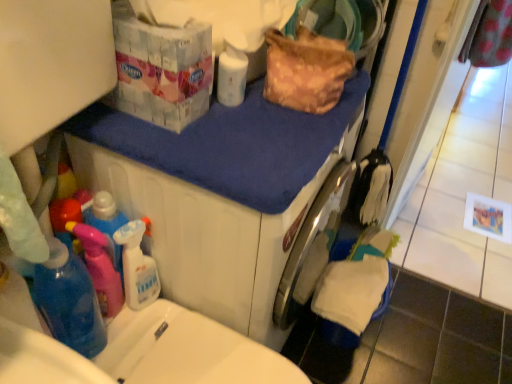
Question: Should I look upward or downward to see white glossy bottle at upper center?

Choices:
 (A) up
 (B) down

Answer: (A)

Question: Are white glossy bottle at upper center and blue fabric at upper center located far from each other?

Choices:
 (A) yes
 (B) no

Answer: (B)

Question: Is white glossy bottle at upper center not within blue fabric at upper center?

Choices:
 (A) no
 (B) yes

Answer: (B)

Question: From the image's perspective, is white glossy bottle at upper center over blue fabric at upper center?

Choices:
 (A) no
 (B) yes

Answer: (B)

Question: From a real-world perspective, is white glossy bottle at upper center on top of blue fabric at upper center?

Choices:
 (A) no
 (B) yes

Answer: (B)

Question: From the image's perspective, does white glossy bottle at upper center appear lower than blue fabric at upper center?

Choices:
 (A) yes
 (B) no

Answer: (B)

Question: From a real-world perspective, does white glossy bottle at upper center sit lower than blue fabric at upper center?

Choices:
 (A) no
 (B) yes

Answer: (A)

Question: Considering the relative positions of blue fabric at upper center and white glossy bottle at upper center in the image provided, is blue fabric at upper center to the right of white glossy bottle at upper center from the viewer's perspective?

Choices:
 (A) yes
 (B) no

Answer: (A)

Question: Is blue fabric at upper center far from white glossy bottle at upper center?

Choices:
 (A) no
 (B) yes

Answer: (A)

Question: Does blue fabric at upper center have a lesser width compared to white glossy bottle at upper center?

Choices:
 (A) yes
 (B) no

Answer: (B)

Question: Are blue fabric at upper center and white glossy bottle at upper center beside each other?

Choices:
 (A) no
 (B) yes

Answer: (A)

Question: Does blue fabric at upper center turn towards white glossy bottle at upper center?

Choices:
 (A) no
 (B) yes

Answer: (A)

Question: Is blue fabric at upper center completely or partially outside of white glossy bottle at upper center?

Choices:
 (A) no
 (B) yes

Answer: (B)

Question: In terms of height, does blue fabric at upper center look taller or shorter compared to white glossy bottle at upper center?

Choices:
 (A) tall
 (B) short

Answer: (B)